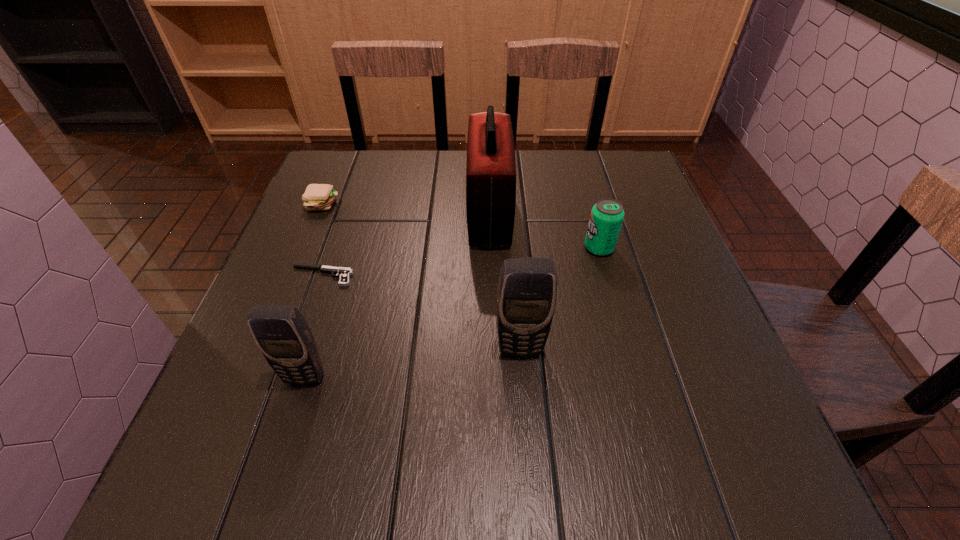
This screenshot has height=540, width=960. Identify the location of the nearest object. (283, 336).

At what (x,y) coordinates should I click in order to perform the action: click on the fourth shortest object. Please return your answer as a coordinate pair (x, y). The width and height of the screenshot is (960, 540). Looking at the image, I should click on coord(283,336).

Where is `the farther cellular telephone`? the farther cellular telephone is located at coordinates (526, 297).

Where is `the right cellular telephone`? This screenshot has width=960, height=540. the right cellular telephone is located at coordinates (526, 297).

The height and width of the screenshot is (540, 960). Identify the location of the fifth tallest object. (317, 196).

Identify the location of the rightmost object. (607, 215).

At what (x,y) coordinates should I click in order to perform the action: click on pop soda. Please return your answer as a coordinate pair (x, y). This screenshot has width=960, height=540. Looking at the image, I should click on (607, 215).

Identify the location of the first aid kit. (491, 167).

Locate an element on the screen. pistol is located at coordinates (343, 273).

I want to click on the fourth farthest object, so click(343, 273).